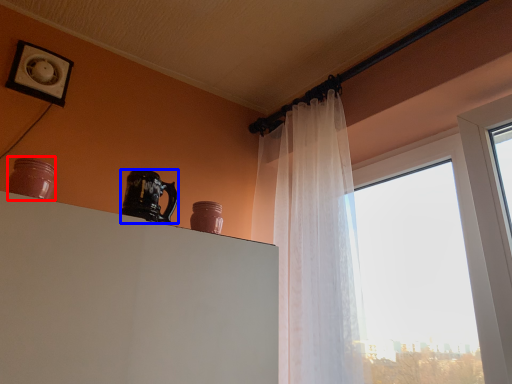
Question: Which object appears closest to the camera in this image, pottery (highlighted by a red box) or coffee cup (highlighted by a blue box)?

Choices:
 (A) pottery
 (B) coffee cup

Answer: (A)